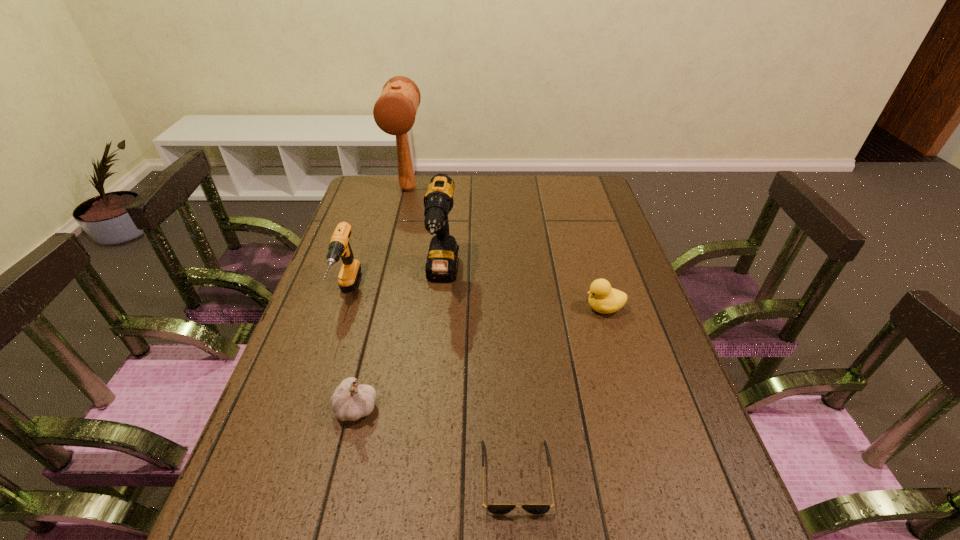
Locate an element on the screen. the farthest object is located at coordinates (394, 112).

Find the location of `the tallest object`. the tallest object is located at coordinates (394, 112).

The image size is (960, 540). I want to click on the second tallest object, so click(x=442, y=261).

Locate an element on the screen. the fourth object from left to right is located at coordinates (442, 261).

Find the location of a particular element. The height and width of the screenshot is (540, 960). the third tallest object is located at coordinates (339, 246).

Locate an element on the screen. the left drill is located at coordinates coord(339,246).

Where is `the third shortest object`? the third shortest object is located at coordinates (350, 401).

I want to click on the fifth farthest object, so click(350, 401).

Locate an element on the screen. Image resolution: width=960 pixels, height=540 pixels. the second shortest object is located at coordinates (602, 298).

The image size is (960, 540). What are the coordinates of `the rightmost object` in the screenshot? It's located at [602, 298].